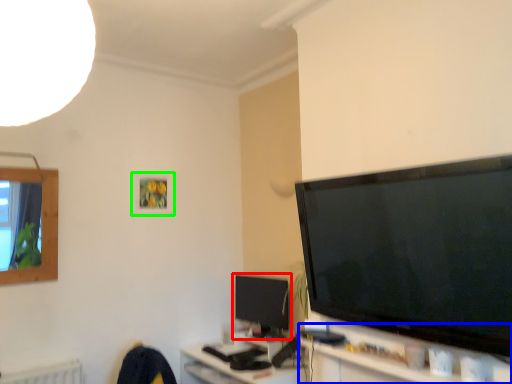
Question: Which object is the closest to the television (highlighted by a red box)? Choose among these: tv cabinet (highlighted by a blue box) or picture frame (highlighted by a green box).

Choices:
 (A) tv cabinet
 (B) picture frame

Answer: (B)